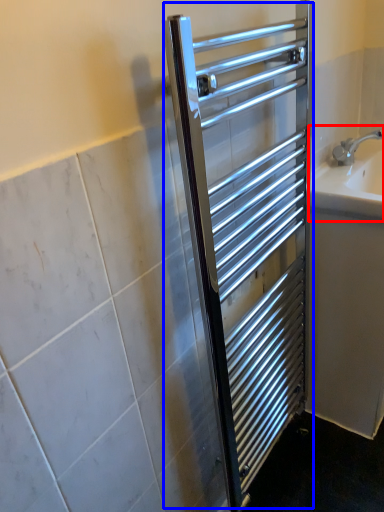
Question: Which point is further to the camera, sink (highlighted by a red box) or screen door (highlighted by a blue box)?

Choices:
 (A) sink
 (B) screen door

Answer: (A)